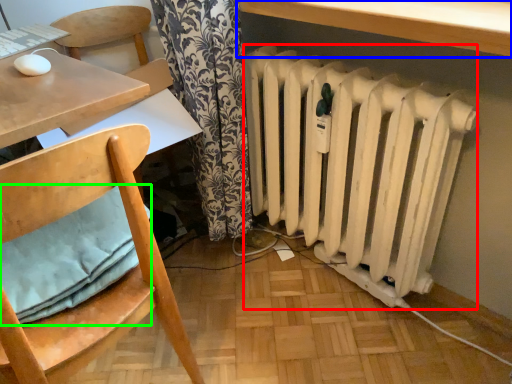
Question: Which is nearer to the radiator (highlighted by a red box)? table (highlighted by a blue box) or pillow (highlighted by a green box).

Choices:
 (A) table
 (B) pillow

Answer: (A)